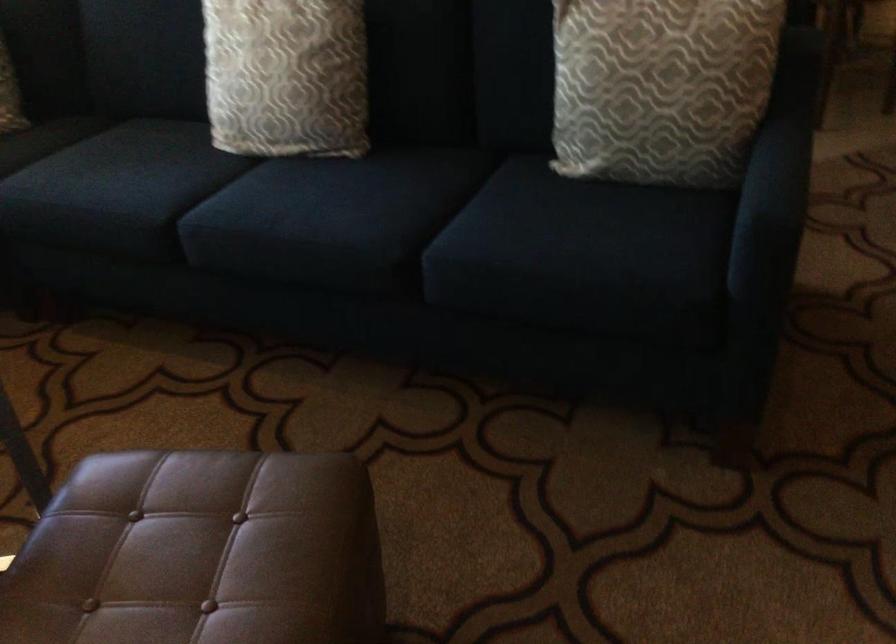
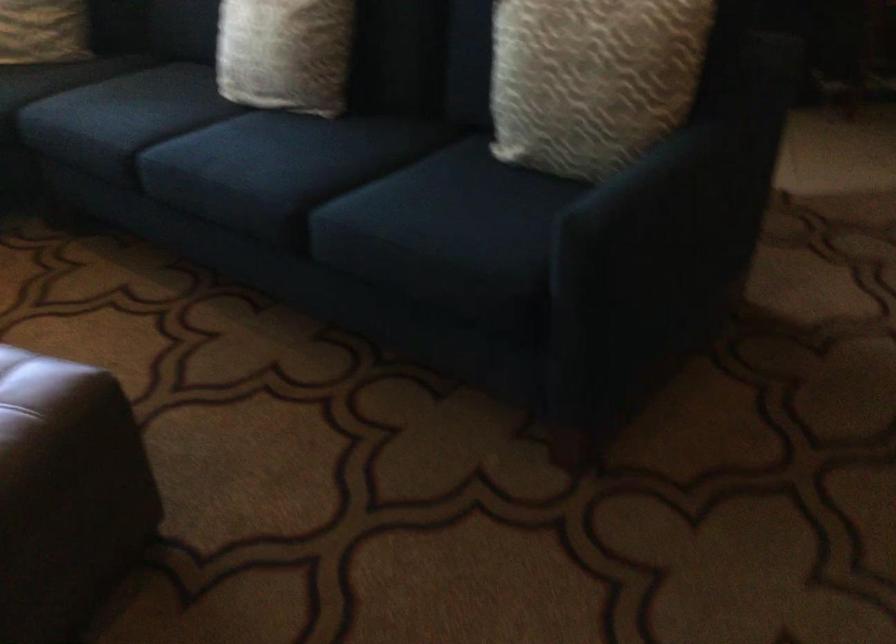
In the second image, find the point that corresponds to the point at 307,207 in the first image.

(245, 154)